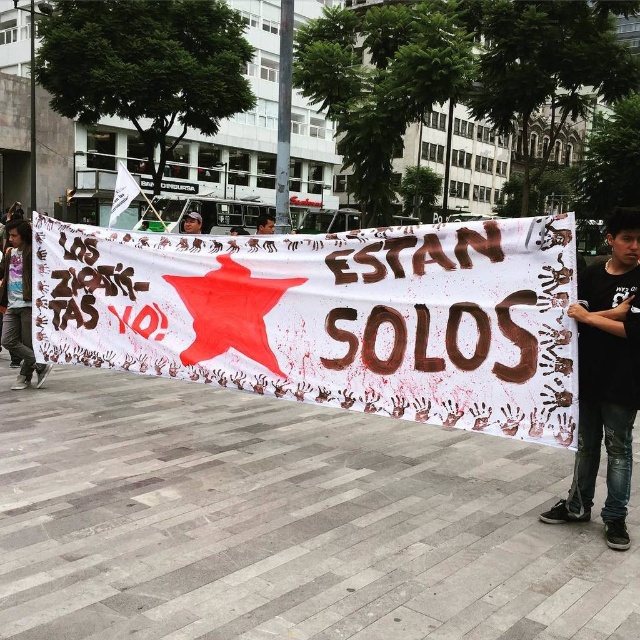
Can you confirm if black cotton shirt at lower right is positioned below dark hair at center?

Indeed, black cotton shirt at lower right is positioned under dark hair at center.

Is black cotton shirt at lower right taller than dark hair at center?

In fact, black cotton shirt at lower right may be shorter than dark hair at center.

Is point (628, 358) positioned behind point (266, 214)?

No, it is in front of (266, 214).

Image resolution: width=640 pixels, height=640 pixels. I want to click on black cotton shirt at lower right, so click(x=605, y=380).

Is white paper banner at center taller than vivid purple t-shirt at left?

In fact, white paper banner at center may be shorter than vivid purple t-shirt at left.

Between point (154, 269) and point (28, 243), which one is positioned in front?

Positioned in front is point (154, 269).

Image resolution: width=640 pixels, height=640 pixels. In order to click on white paper banner at center in this screenshot , I will do `click(330, 316)`.

Based on the photo, between white paper flag at upper left and dark hair at center, which one appears on the left side from the viewer's perspective?

Positioned to the left is white paper flag at upper left.

Can you confirm if white paper flag at upper left is shorter than dark hair at center?

No.

Image resolution: width=640 pixels, height=640 pixels. I want to click on white paper flag at upper left, so click(x=122, y=193).